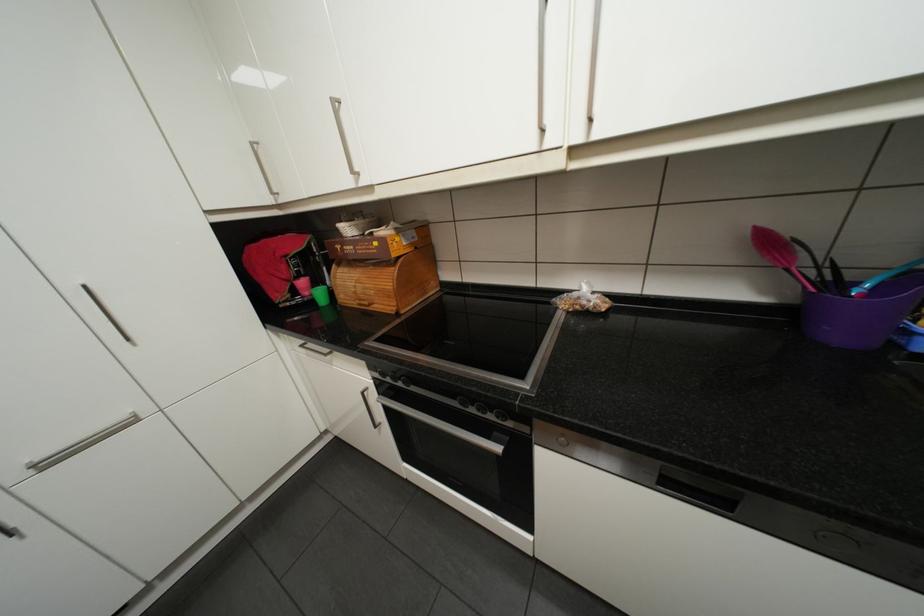
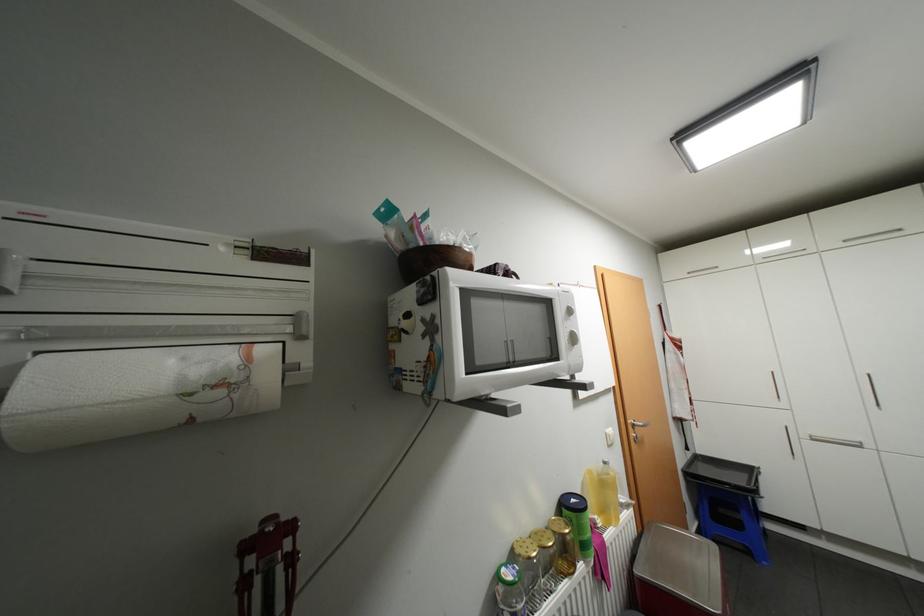
In the second image, find the point that corresponds to point (54, 464) in the first image.

(821, 438)